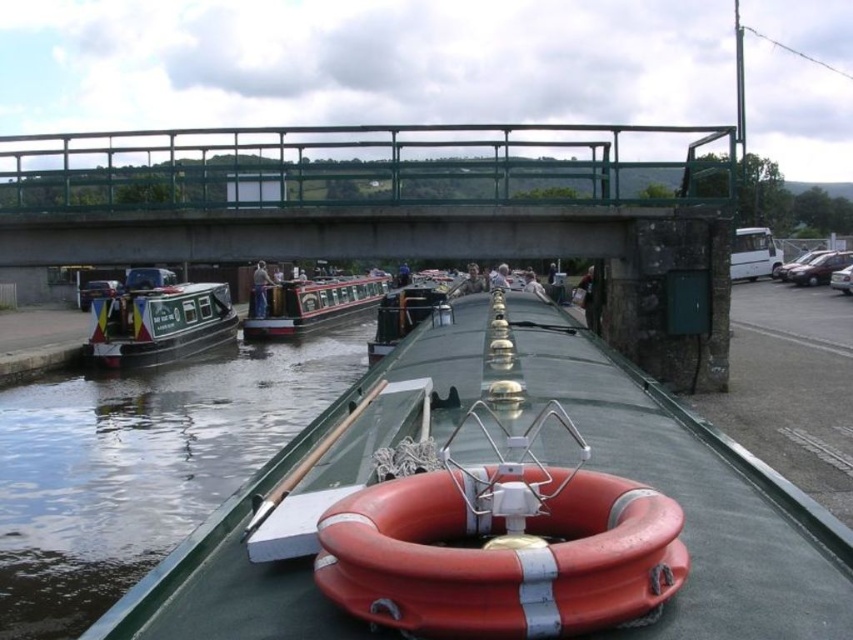
Question: Which point is closer to the camera taking this photo?

Choices:
 (A) (309, 298)
 (B) (531, 163)

Answer: (B)

Question: Among these objects, which one is farthest from the camera?

Choices:
 (A) polished wood canal boat at center
 (B) green painted wood canal boat at left

Answer: (A)

Question: Can you confirm if green painted wood canal boat at left is smaller than polished wood canal boat at center?

Choices:
 (A) no
 (B) yes

Answer: (A)

Question: Which point is farther to the camera?

Choices:
 (A) (260, 332)
 (B) (427, 604)
 (C) (560, 216)
 (D) (140, 364)

Answer: (A)

Question: From the image, what is the correct spatial relationship of green painted wood canal boat at left in relation to polished wood canal boat at center?

Choices:
 (A) below
 (B) above

Answer: (A)

Question: Is green metal bridge at upper center above polished wood canal boat at center?

Choices:
 (A) yes
 (B) no

Answer: (A)